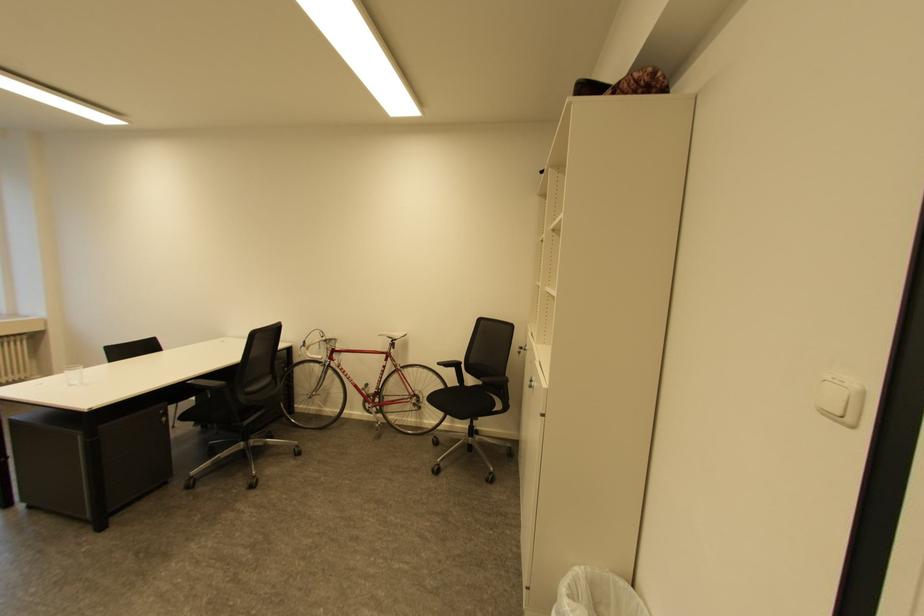
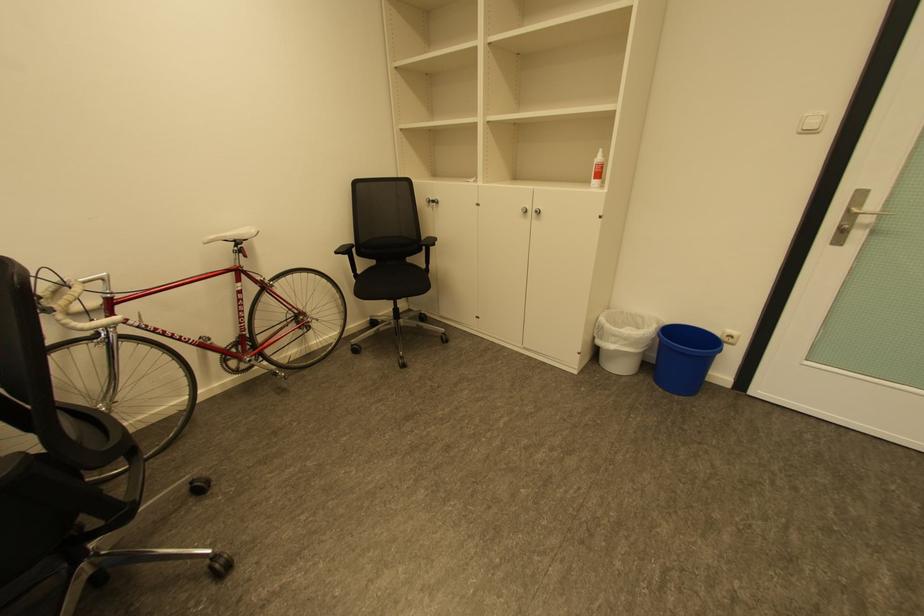
Locate, in the second image, the point that corresponds to (445,363) in the first image.

(344, 253)